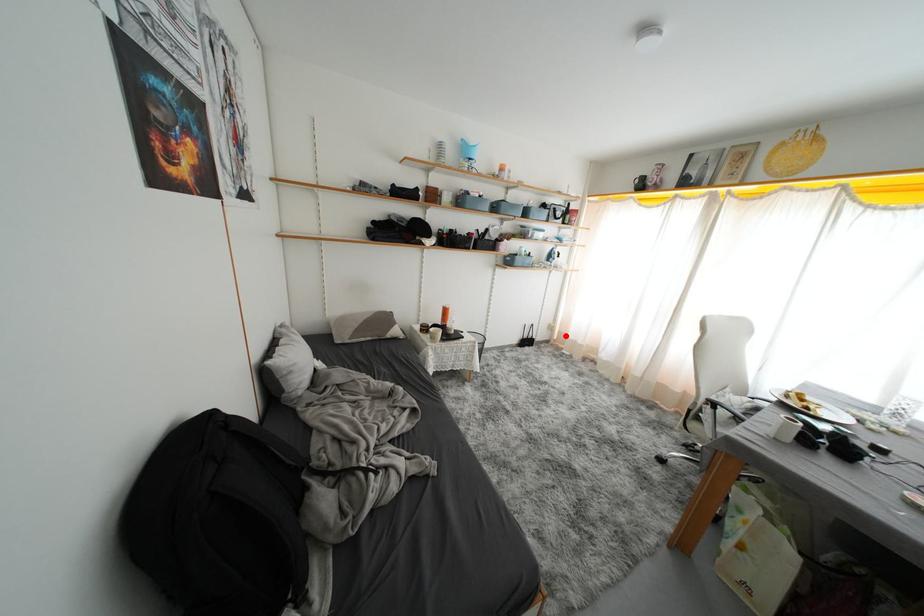
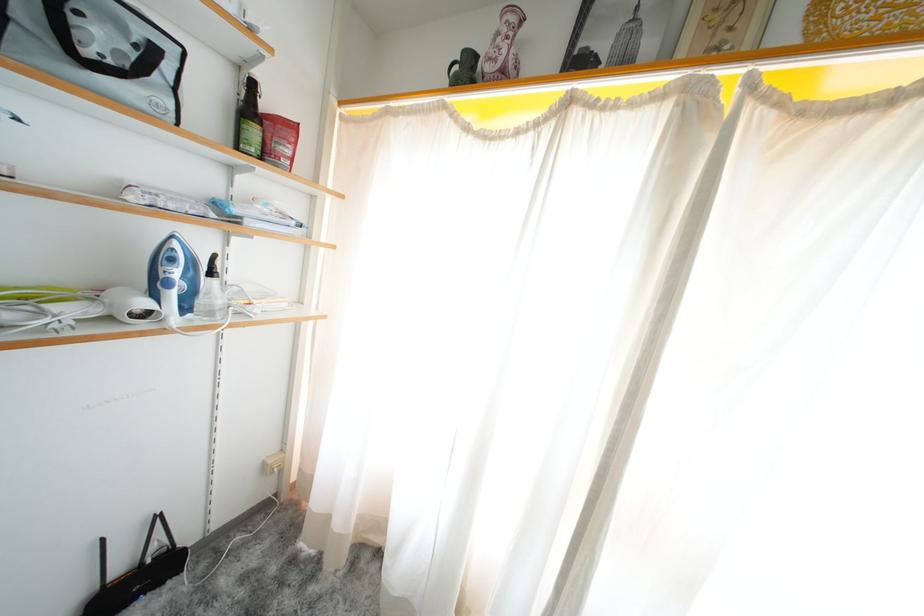
The point at the highlighted location is marked in the first image. Where is the corresponding point in the second image?

(306, 475)